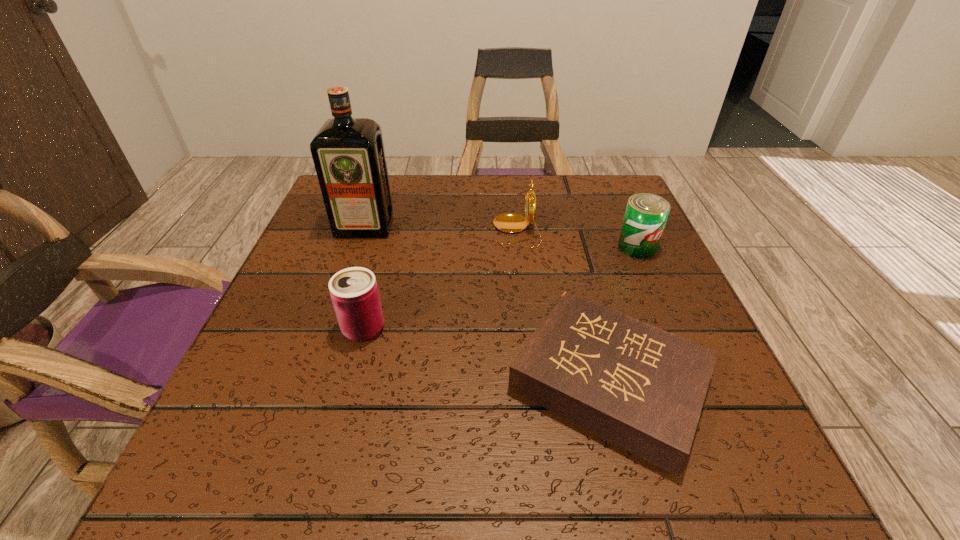
Locate an element on the screen. This screenshot has width=960, height=540. free space that satisfies the following two spatial constraints: 1. on the back side of the farther can; 2. on the face of the pocket watch is located at coordinates (630, 231).

Locate an element on the screen. blank space that satisfies the following two spatial constraints: 1. on the face of the farther can; 2. on the right side of the pocket watch is located at coordinates coord(518,247).